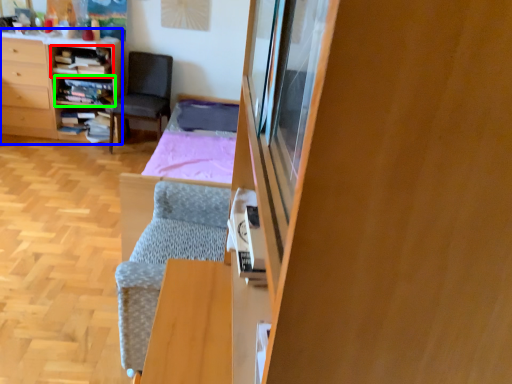
Question: Considering the real-world distances, which object is closest to shelf (highlighted by a red box)? desk (highlighted by a blue box) or shelf (highlighted by a green box).

Choices:
 (A) desk
 (B) shelf

Answer: (B)